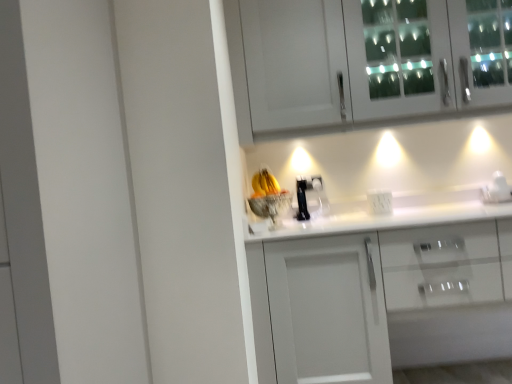
Question: Would you consider white glass cabinet at upper center, which is the 2th cabinetry from bottom to top, to be distant from white glossy coffee maker at right?

Choices:
 (A) yes
 (B) no

Answer: (B)

Question: Can you confirm if white glass cabinet at upper center, the 1th cabinetry viewed from the top, is thinner than white glossy coffee maker at right?

Choices:
 (A) no
 (B) yes

Answer: (A)

Question: Could you tell me if white glass cabinet at upper center, the 1th cabinetry viewed from the top, is turned towards white glossy coffee maker at right?

Choices:
 (A) yes
 (B) no

Answer: (B)

Question: Considering the relative sizes of white glass cabinet at upper center, which is the 2th cabinetry from bottom to top, and white glossy coffee maker at right in the image provided, is white glass cabinet at upper center, which is the 2th cabinetry from bottom to top, shorter than white glossy coffee maker at right?

Choices:
 (A) yes
 (B) no

Answer: (B)

Question: From the image's perspective, is white glass cabinet at upper center, the 1th cabinetry viewed from the top, beneath white glossy coffee maker at right?

Choices:
 (A) yes
 (B) no

Answer: (B)

Question: From their relative heights in the image, would you say white plastic electric outlet at center is taller or shorter than white glossy cabinet at center, the second cabinetry viewed from the top?

Choices:
 (A) short
 (B) tall

Answer: (A)

Question: In the image, is white plastic electric outlet at center on the left side or the right side of white glossy cabinet at center, the second cabinetry viewed from the top?

Choices:
 (A) right
 (B) left

Answer: (B)

Question: Relative to white glossy cabinet at center, the second cabinetry viewed from the top, is white plastic electric outlet at center in front or behind?

Choices:
 (A) front
 (B) behind

Answer: (B)

Question: Do you think white plastic electric outlet at center is within white glossy cabinet at center, which is counted as the first cabinetry, starting from the bottom, or outside of it?

Choices:
 (A) outside
 (B) inside

Answer: (B)

Question: In the image, is white glossy coffee maker at right positioned in front of or behind white plastic electric outlet at center?

Choices:
 (A) front
 (B) behind

Answer: (A)

Question: Is white glossy coffee maker at right wider or thinner than white plastic electric outlet at center?

Choices:
 (A) wide
 (B) thin

Answer: (A)

Question: From a real-world perspective, relative to white plastic electric outlet at center, is white glossy coffee maker at right vertically above or below?

Choices:
 (A) above
 (B) below

Answer: (A)

Question: From the image's perspective, is white glossy coffee maker at right located above or below white plastic electric outlet at center?

Choices:
 (A) above
 (B) below

Answer: (A)

Question: From a real-world perspective, is white glossy coffee maker at right positioned above or below white glossy cabinet at center, the second cabinetry viewed from the top?

Choices:
 (A) below
 (B) above

Answer: (B)

Question: Considering the positions of white glossy coffee maker at right and white glossy cabinet at center, the second cabinetry viewed from the top, in the image, is white glossy coffee maker at right bigger or smaller than white glossy cabinet at center, the second cabinetry viewed from the top,?

Choices:
 (A) small
 (B) big

Answer: (A)